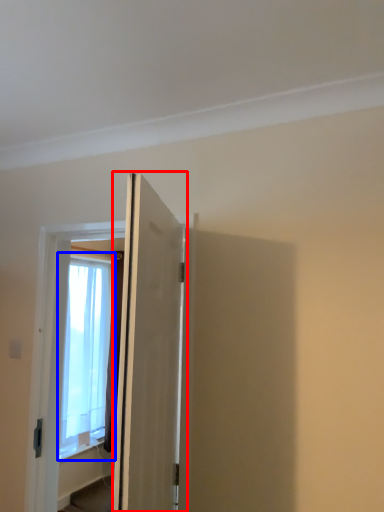
Question: Which object appears closest to the camera in this image, door (highlighted by a red box) or window (highlighted by a blue box)?

Choices:
 (A) door
 (B) window

Answer: (A)